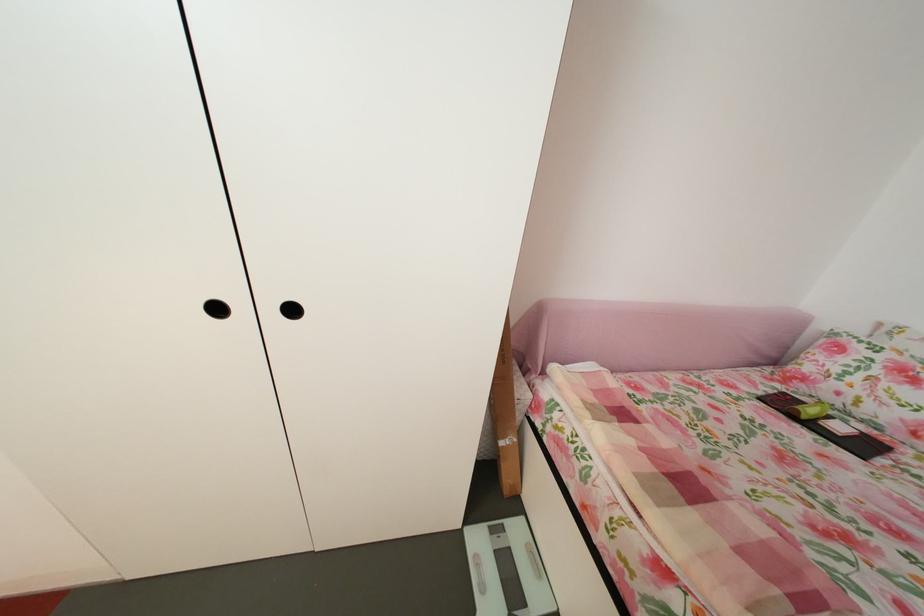
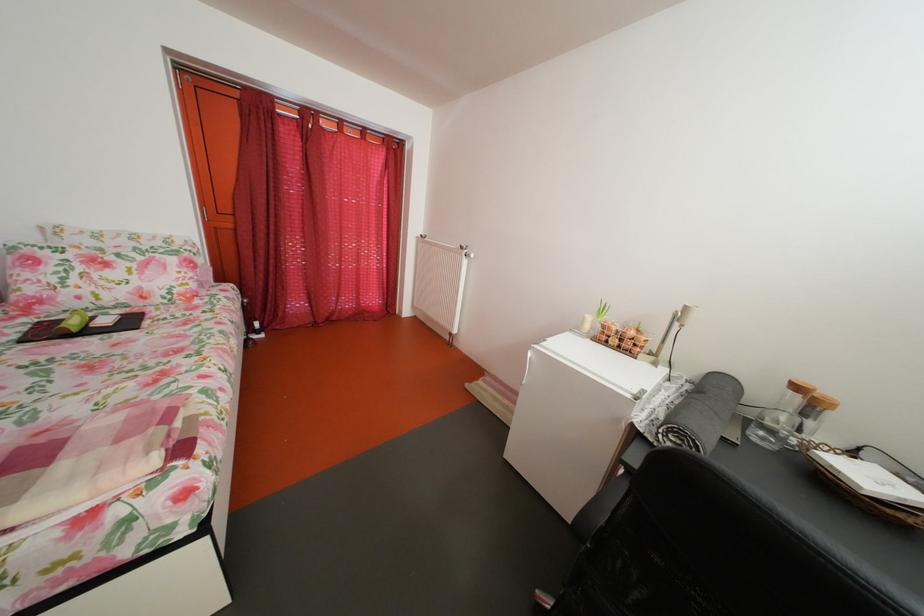
In the second image, find the point that corresponds to the point at 812,408 in the first image.

(73, 326)